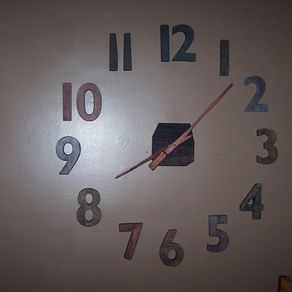
Identify the location of dark shadowed corner. (14, 9), (7, 273), (271, 275), (278, 15).